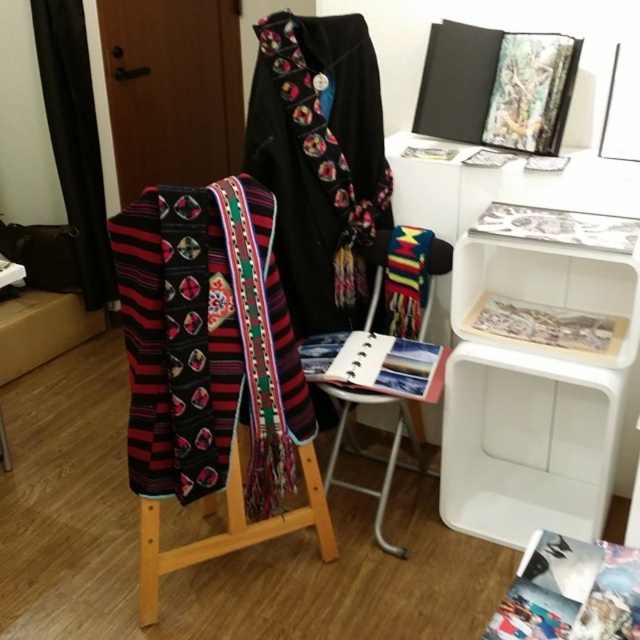
Which is behind, point (257, 134) or point (330, 397)?

Point (330, 397)

Which is below, black embroidered robe at center or wooden folding chair at center?

wooden folding chair at center

Between point (376, 93) and point (372, 488), which one is positioned behind?

The point (372, 488) is behind.

In order to click on black embroidered robe at center in this screenshot , I will do click(320, 161).

Is point (596, 452) more distant than point (364, 51)?

Yes, point (596, 452) is farther from viewer.

Based on the photo, is white plastic table at upper right positioned at the back of black embroidered robe at center?

No, it is not.

Which is in front, point (490, 358) or point (358, 182)?

Positioned in front is point (490, 358).

This screenshot has height=640, width=640. Identify the location of white plastic table at upper right. (538, 394).

Is point (209, 442) positioned in front of point (428, 260)?

That is True.

Describe the element at coordinates (208, 342) in the screenshot. The height and width of the screenshot is (640, 640). I see `embroidered wool scarf at center` at that location.

The height and width of the screenshot is (640, 640). I want to click on embroidered wool scarf at center, so click(x=208, y=342).